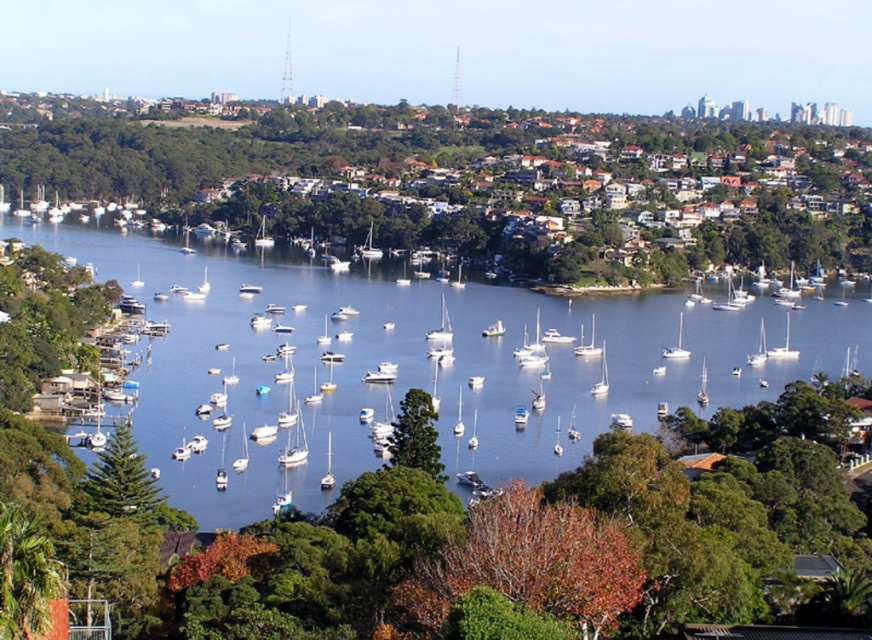
Question: Is the position of green matte tree at lower left less distant than that of white matte sailboat at center?

Choices:
 (A) no
 (B) yes

Answer: (B)

Question: Where is blue water at center located in relation to green leafy tree at center in the image?

Choices:
 (A) above
 (B) below

Answer: (B)

Question: Which point appears farthest from the camera in this image?

Choices:
 (A) (159, 282)
 (B) (673, 355)

Answer: (A)

Question: Which of these objects is positioned closest to the green matte tree at lower left?

Choices:
 (A) white matte sailboat at center
 (B) white glossy sailboat at center

Answer: (A)

Question: Among these points, which one is farthest from the camera?

Choices:
 (A) (687, 352)
 (B) (392, 454)
 (C) (78, 516)

Answer: (A)

Question: Does blue water at center appear over green textured tree at center?

Choices:
 (A) no
 (B) yes

Answer: (B)